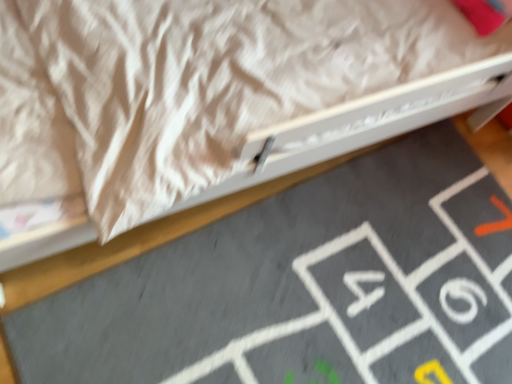
At what (x,y) coordinates should I click in order to perform the action: click on blank space situated above gray rubber doormat at center (from a real-world perspective). Please return your answer as a coordinate pair (x, y). Looking at the image, I should click on (336, 298).